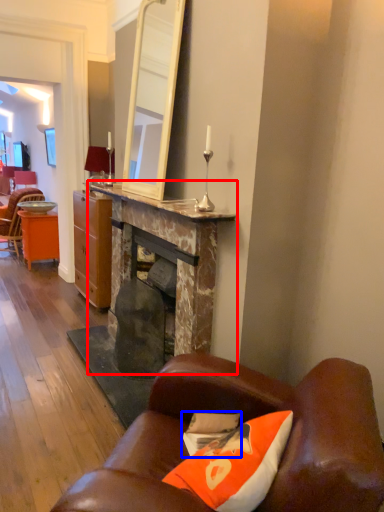
Question: Which of the following is the closest to the observer, table (highlighted by a red box) or pillow (highlighted by a blue box)?

Choices:
 (A) table
 (B) pillow

Answer: (B)